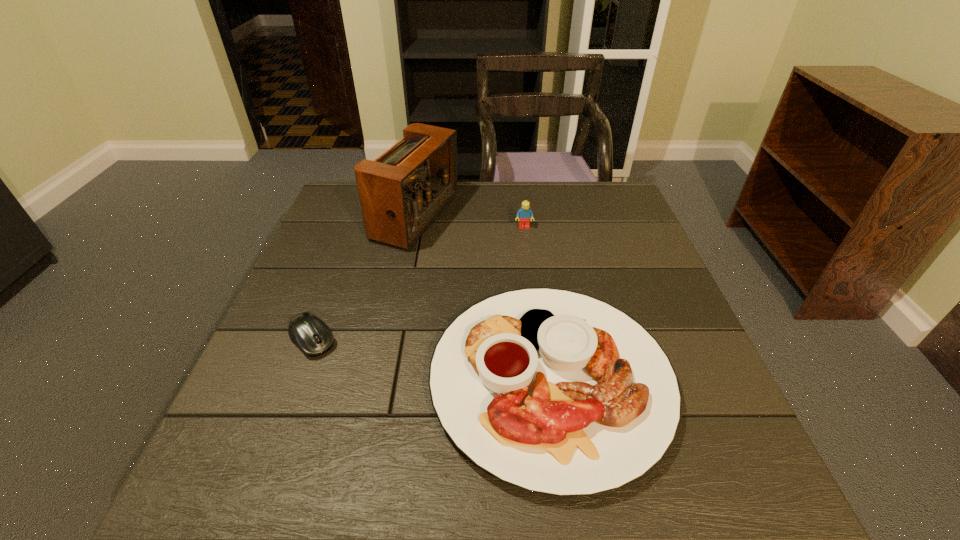
This screenshot has width=960, height=540. In order to click on radio receiver present at the left edge in this screenshot , I will do pos(402,192).

Identify the location of mouse at the left edge. The width and height of the screenshot is (960, 540). (310, 334).

Find the location of `object located at the right edge`. object located at the right edge is located at coordinates (556, 392).

Find the location of a particular element. object that is at the far left corner is located at coordinates (402, 192).

Locate an element on the screen. The height and width of the screenshot is (540, 960). object at the near right corner is located at coordinates (556, 392).

In the image, there is a desktop. Where is `vacant region at the far edge`? The height and width of the screenshot is (540, 960). vacant region at the far edge is located at coordinates (552, 181).

In the image, there is a desktop. Where is `vacant space at the near edge`? vacant space at the near edge is located at coordinates (329, 469).

Locate an element on the screen. This screenshot has height=540, width=960. free space at the left edge is located at coordinates (322, 294).

In the image, there is a desktop. Where is `vacant area at the right edge`? This screenshot has height=540, width=960. vacant area at the right edge is located at coordinates (691, 340).

Image resolution: width=960 pixels, height=540 pixels. In the image, there is a desktop. What are the coordinates of `vacant space at the far left corner` in the screenshot? It's located at (357, 189).